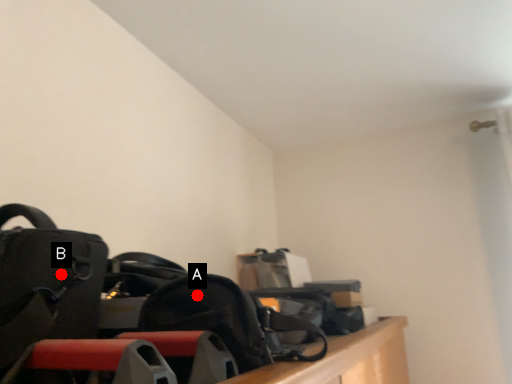
Question: Two points are circled on the image, labeled by A and B beside each circle. Which point appears farthest from the camera in this image?

Choices:
 (A) A is further
 (B) B is further

Answer: (A)